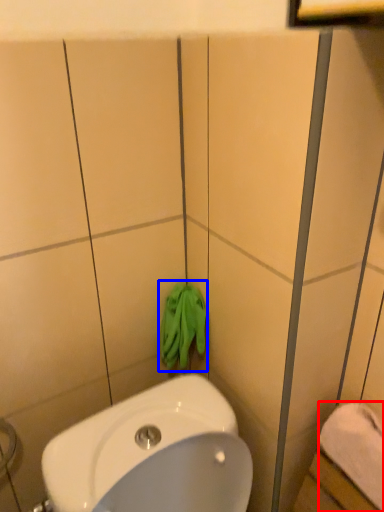
Question: Among these objects, which one is nearest to the camera, towel/napkin (highlighted by a red box) or bath towel (highlighted by a blue box)?

Choices:
 (A) towel/napkin
 (B) bath towel

Answer: (A)